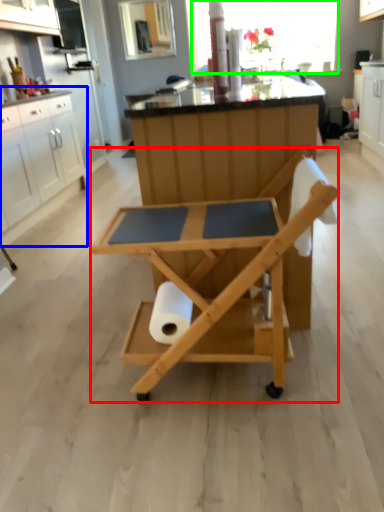
Question: Which object is the closest to the table (highlighted by a red box)? Choose among these: cabinetry (highlighted by a blue box) or window screen (highlighted by a green box).

Choices:
 (A) cabinetry
 (B) window screen

Answer: (A)